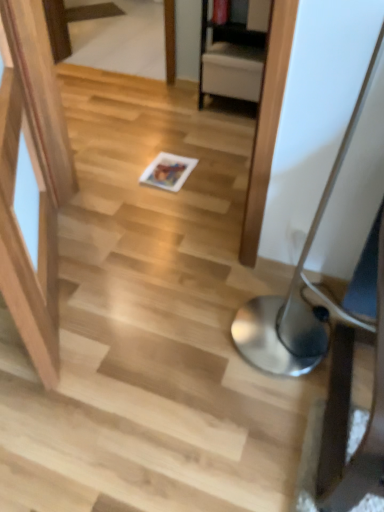
Question: Based on their sizes in the image, would you say silver metallic table lamp at lower right is bigger or smaller than white glossy magazine at center?

Choices:
 (A) small
 (B) big

Answer: (B)

Question: Visually, is silver metallic table lamp at lower right positioned to the left or to the right of white glossy magazine at center?

Choices:
 (A) left
 (B) right

Answer: (B)

Question: Is silver metallic table lamp at lower right spatially inside white glossy magazine at center, or outside of it?

Choices:
 (A) inside
 (B) outside

Answer: (B)

Question: From a real-world perspective, relative to silver metallic table lamp at lower right, is white glossy magazine at center vertically above or below?

Choices:
 (A) below
 (B) above

Answer: (A)

Question: From the image's perspective, is white glossy magazine at center located above or below silver metallic table lamp at lower right?

Choices:
 (A) below
 (B) above

Answer: (B)

Question: Is point (x=188, y=159) positioned closer to the camera than point (x=238, y=330)?

Choices:
 (A) closer
 (B) farther

Answer: (B)

Question: In the image, is white glossy magazine at center positioned in front of or behind silver metallic table lamp at lower right?

Choices:
 (A) behind
 (B) front

Answer: (A)